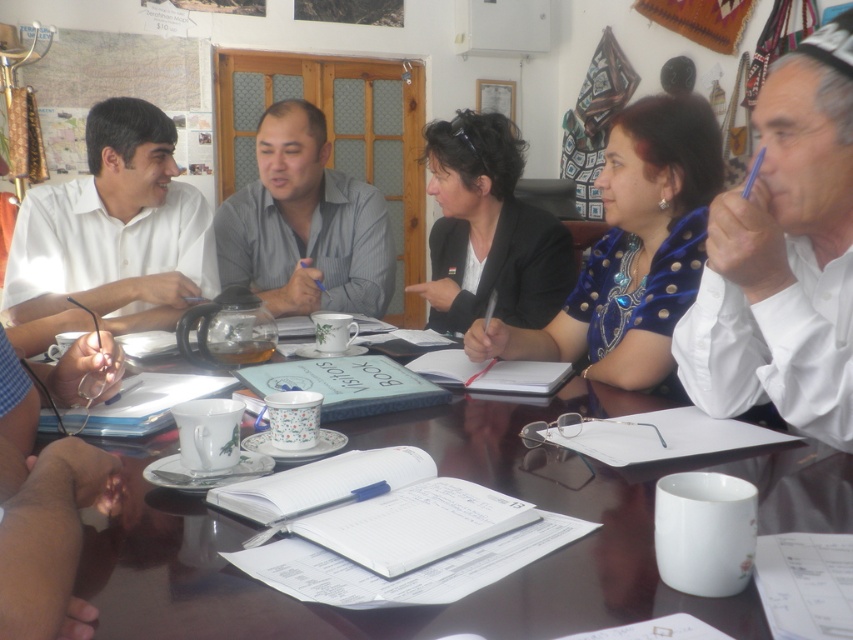
Question: From the image, what is the correct spatial relationship of glossy wooden table at center in relation to blue embroidered blouse at center?

Choices:
 (A) above
 (B) below

Answer: (B)

Question: Does white shirt at right have a greater width compared to black matte jacket at center?

Choices:
 (A) yes
 (B) no

Answer: (B)

Question: Which point appears farthest from the camera in this image?

Choices:
 (A) (364, 307)
 (B) (450, 323)

Answer: (A)

Question: Which point is farther to the camera?

Choices:
 (A) black matte jacket at center
 (B) gray striped shirt at center

Answer: (B)

Question: Is glossy wooden table at center smaller than black matte jacket at center?

Choices:
 (A) no
 (B) yes

Answer: (B)

Question: Which object is closer to the camera taking this photo?

Choices:
 (A) blue embroidered blouse at center
 (B) glossy wooden table at center
 (C) gray striped shirt at center

Answer: (B)